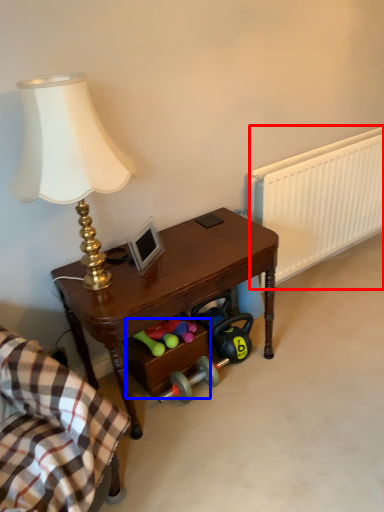
Question: Which of the following is the farthest to the observer, radiator (highlighted by a red box) or drawer (highlighted by a blue box)?

Choices:
 (A) radiator
 (B) drawer

Answer: (A)